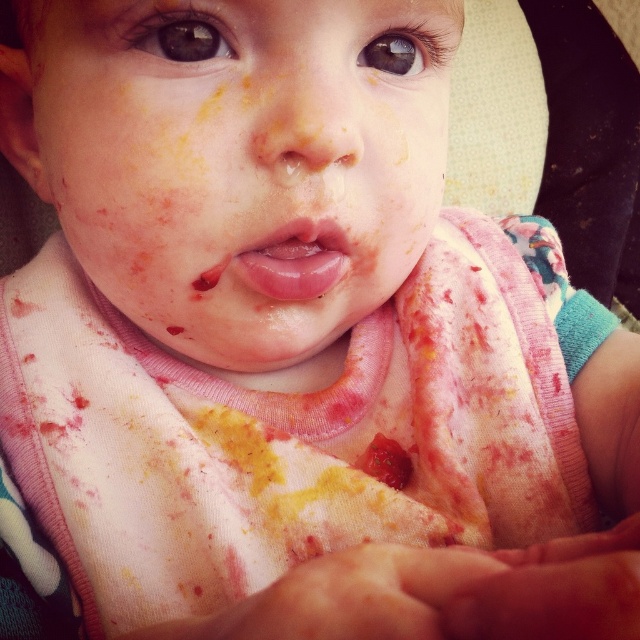
Is matte pink bib at center positioned in front of glossy pink lips at center?

Yes, matte pink bib at center is in front of glossy pink lips at center.

Who is more distant from viewer, (291,317) or (252,260)?

The point (291,317) is more distant.

Locate an element on the screen. matte pink bib at center is located at coordinates (241, 161).